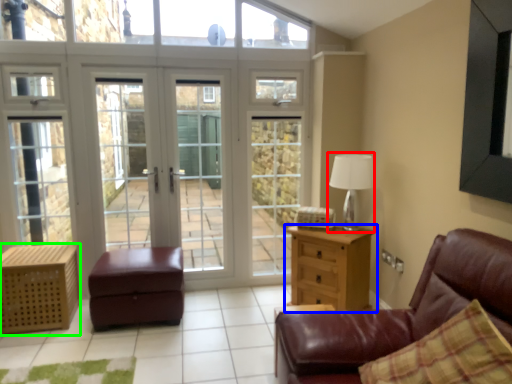
Question: Considering the real-world distances, which object is farthest from table lamp (highlighted by a red box)? chest of drawers (highlighted by a blue box) or nightstand (highlighted by a green box)?

Choices:
 (A) chest of drawers
 (B) nightstand

Answer: (B)